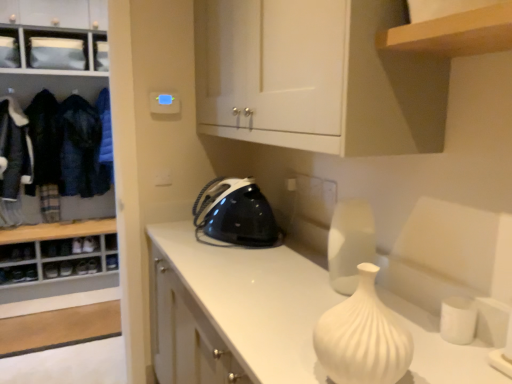
Find the location of a particular element. This screenshot has width=512, height=384. free space that is to the left of white matte vase at center is located at coordinates (270, 350).